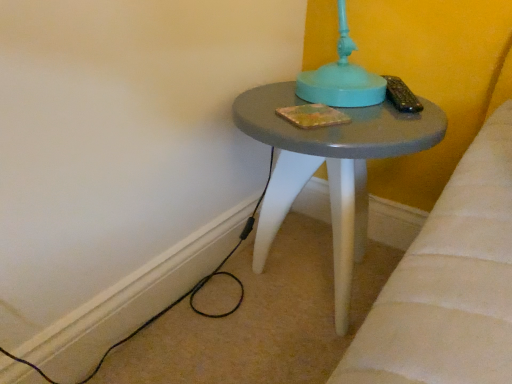
Where is `matte gray stool at center`? This screenshot has height=384, width=512. matte gray stool at center is located at coordinates pyautogui.click(x=330, y=169).

Describe the element at coordinates (330, 169) in the screenshot. This screenshot has height=384, width=512. I see `matte gray stool at center` at that location.

Measure the distance between point (188, 294) and camera.

A distance of 38.03 inches exists between point (188, 294) and camera.

Measure the distance between black wire at lower left and camera.

25.20 inches.

What is the approximate height of black wire at lower left?

black wire at lower left is 5.51 inches in height.

Where is `black wire at lower left`? black wire at lower left is located at coordinates (198, 284).

Describe the element at coordinates (198, 284) in the screenshot. Image resolution: width=512 pixels, height=384 pixels. I see `black wire at lower left` at that location.

The height and width of the screenshot is (384, 512). Identify the location of matte gray stool at center. (330, 169).

Between black wire at lower left and matte gray stool at center, which one appears on the right side from the viewer's perspective?

matte gray stool at center.

Does black wire at lower left lie behind matte gray stool at center?

Yes, it is behind matte gray stool at center.

Which is in front, point (199, 285) or point (364, 225)?

The point (199, 285) is closer to the camera.

From the image's perspective, is black wire at lower left on top of matte gray stool at center?

No.

From a real-world perspective, is black wire at lower left physically located above or below matte gray stool at center?

From a real-world perspective, black wire at lower left is physically below matte gray stool at center.

Does black wire at lower left have a greater width compared to matte gray stool at center?

No, black wire at lower left is not wider than matte gray stool at center.

Consider the image. Considering the sizes of black wire at lower left and matte gray stool at center in the image, is black wire at lower left taller or shorter than matte gray stool at center?

Clearly, black wire at lower left is shorter compared to matte gray stool at center.

Between black wire at lower left and matte gray stool at center, which one has larger size?

matte gray stool at center is bigger.

Based on the photo, is black wire at lower left located outside matte gray stool at center?

Yes.

Are black wire at lower left and matte gray stool at center beside each other?

No.

Is black wire at lower left facing away from matte gray stool at center?

black wire at lower left is not turned away from matte gray stool at center.

How many degrees apart are the facing directions of black wire at lower left and matte gray stool at center?

91.5 degrees separate the facing orientations of black wire at lower left and matte gray stool at center.

The width and height of the screenshot is (512, 384). I want to click on stool lying in front of the black wire at lower left, so click(330, 169).

Considering the relative positions of matte gray stool at center and black wire at lower left in the image provided, is matte gray stool at center to the left or to the right of black wire at lower left?

matte gray stool at center is positioned on black wire at lower left's right side.

Relative to black wire at lower left, is matte gray stool at center in front or behind?

matte gray stool at center is positioned closer to the viewer than black wire at lower left.

Is point (367, 116) positioned behind point (181, 298)?

No, it is in front of (181, 298).

From the image's perspective, who appears lower, matte gray stool at center or black wire at lower left?

black wire at lower left appears lower in the image.

Based on the photo, from a real-world perspective, which is physically above, matte gray stool at center or black wire at lower left?

matte gray stool at center.

In terms of width, does matte gray stool at center look wider or thinner when compared to black wire at lower left?

Considering their sizes, matte gray stool at center looks broader than black wire at lower left.

Between matte gray stool at center and black wire at lower left, which one has less height?

black wire at lower left is shorter.

Does matte gray stool at center have a larger size compared to black wire at lower left?

Yes, matte gray stool at center is bigger than black wire at lower left.

Would you say matte gray stool at center is inside or outside black wire at lower left?

matte gray stool at center is spatially situated outside black wire at lower left.

Is matte gray stool at center not close to black wire at lower left?

No.

Does matte gray stool at center turn towards black wire at lower left?

Yes, matte gray stool at center is turned towards black wire at lower left.

Can you tell me how much matte gray stool at center and black wire at lower left differ in facing direction?

matte gray stool at center and black wire at lower left are facing 91.5 degrees away from each other.

Measure the distance between matte gray stool at center and black wire at lower left.

matte gray stool at center and black wire at lower left are 11.78 inches apart from each other.

The height and width of the screenshot is (384, 512). Find the location of `stool above the black wire at lower left (from a real-world perspective)`. stool above the black wire at lower left (from a real-world perspective) is located at coordinates pos(330,169).

Find the location of a particular element. The width and height of the screenshot is (512, 384). cable below the matte gray stool at center (from a real-world perspective) is located at coordinates (198, 284).

The width and height of the screenshot is (512, 384). What are the coordinates of `cable located on the left of matte gray stool at center` in the screenshot? It's located at (198, 284).